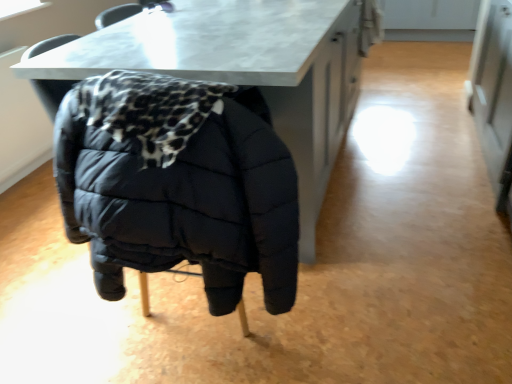
The width and height of the screenshot is (512, 384). I want to click on vacant area located to the right-hand side of matte black puffer jacket at center, so click(328, 298).